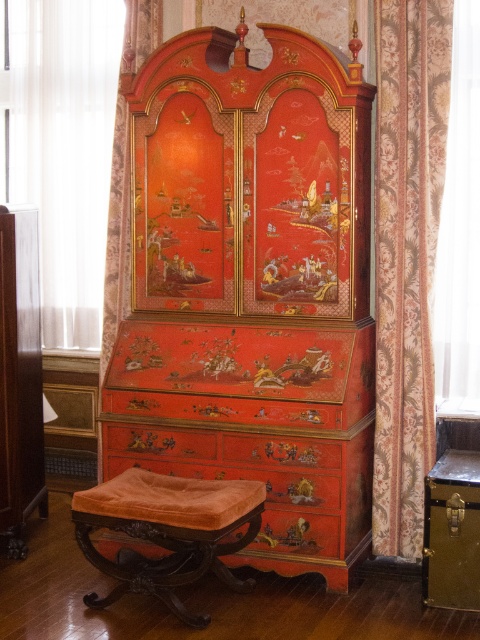
Is floral fabric curtain at right to the right of matte lacquered cabinet at left from the viewer's perspective?

Correct, you'll find floral fabric curtain at right to the right of matte lacquered cabinet at left.

Find the location of a particular element. floral fabric curtain at right is located at coordinates click(407, 256).

Identify the location of cherry lacquer cabinet at center. This screenshot has height=640, width=480. [252, 288].

Does cherry lacquer cabinet at center have a lesser height compared to velvet orange stool at lower center?

No.

You are a GUI agent. You are given a task and a screenshot of the screen. Output one action in this format:
    pyautogui.click(x=<x>, y=<y>)
    Task: Click on the cherry lacquer cabinet at center
    This screenshot has width=480, height=640.
    Given the screenshot: What is the action you would take?
    pyautogui.click(x=252, y=288)

Find the location of a particular element. Image resolution: width=480 pixels, height=640 pixels. cherry lacquer cabinet at center is located at coordinates (252, 288).

Who is lower down, matte lacquered cabinet at left or metallic gold chest at lower right?

metallic gold chest at lower right

This screenshot has height=640, width=480. In order to click on matte lacquered cabinet at left in this screenshot , I will do `click(20, 378)`.

Locate an element on the screen. matte lacquered cabinet at left is located at coordinates (20, 378).